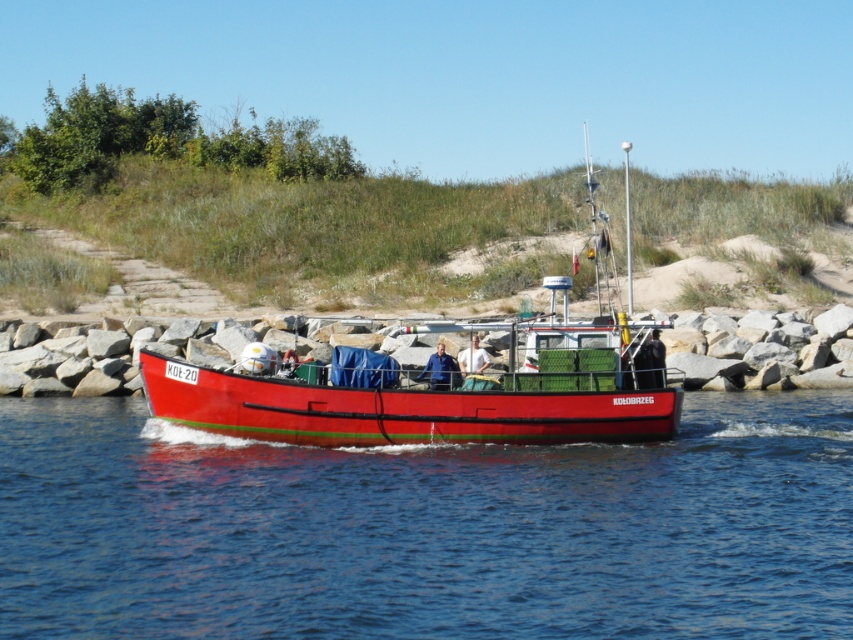
You are a passenger on the red fishing boat named Kolobrzeg. You notice two pieces of clothing at the center of the boat. The blue fabric jacket at center and the white fabric shirt at center. Which one is covering the other?

The blue fabric jacket at center is positioned over the white fabric shirt at center, so the jacket is covering the shirt.